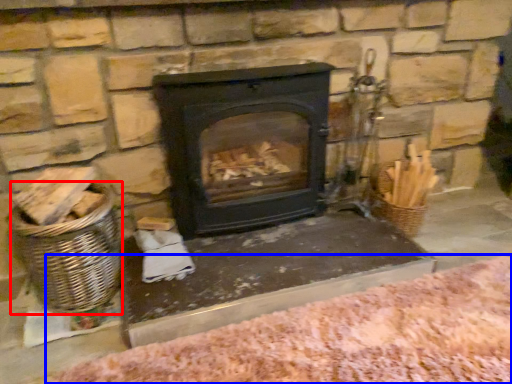
Question: Which point is closer to the camera, basket (highlighted by a red box) or blanket (highlighted by a blue box)?

Choices:
 (A) basket
 (B) blanket

Answer: (B)